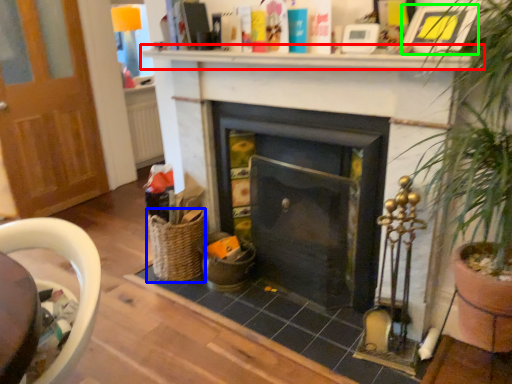
Question: Based on their relative distances, which object is nearer to mantle (highlighted by a red box)? Choose from basket (highlighted by a blue box) and picture frame (highlighted by a green box).

Choices:
 (A) basket
 (B) picture frame

Answer: (B)